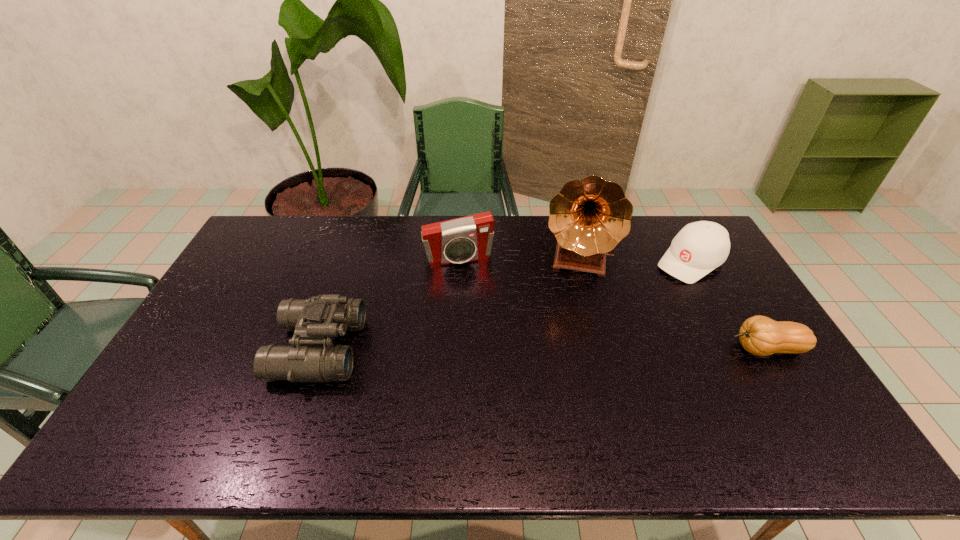
Where is `free space between the second object from left to right and the tallest object`? free space between the second object from left to right and the tallest object is located at coordinates (517, 259).

This screenshot has width=960, height=540. In order to click on vacant area that lies between the binoculars and the gourd in this screenshot , I will do `click(542, 349)`.

Identify the location of vacant point located between the tallest object and the leftmost object. This screenshot has width=960, height=540. (447, 305).

At what (x,y) coordinates should I click in order to perform the action: click on empty location between the fourth tallest object and the binoculars. Please return your answer as a coordinate pair (x, y). The width and height of the screenshot is (960, 540). Looking at the image, I should click on (505, 306).

Where is `empty space that is in between the binoculars and the shortest object`? The image size is (960, 540). empty space that is in between the binoculars and the shortest object is located at coordinates (542, 349).

You are a GUI agent. You are given a task and a screenshot of the screen. Output one action in this format:
    pyautogui.click(x=<x>, y=<y>)
    Task: Click on the free space that is in between the second object from left to right and the leftmost object
    The height and width of the screenshot is (540, 960).
    Given the screenshot: What is the action you would take?
    pyautogui.click(x=389, y=303)

At what (x,y) coordinates should I click in order to perform the action: click on unoccupied area between the leftmost object and the baseball cap. Please return your answer as a coordinate pair (x, y). The image size is (960, 540). Looking at the image, I should click on (505, 306).

At what (x,y) coordinates should I click in order to perform the action: click on unoccupied area between the leftmost object and the fourth object from right to left. Please return your answer as a coordinate pair (x, y). Looking at the image, I should click on pos(389,303).

Locate an element on the screen. This screenshot has width=960, height=540. free space between the phonograph_record and the shortest object is located at coordinates (671, 305).

I want to click on the fourth closest object relative to the leftmost object, so click(759, 335).